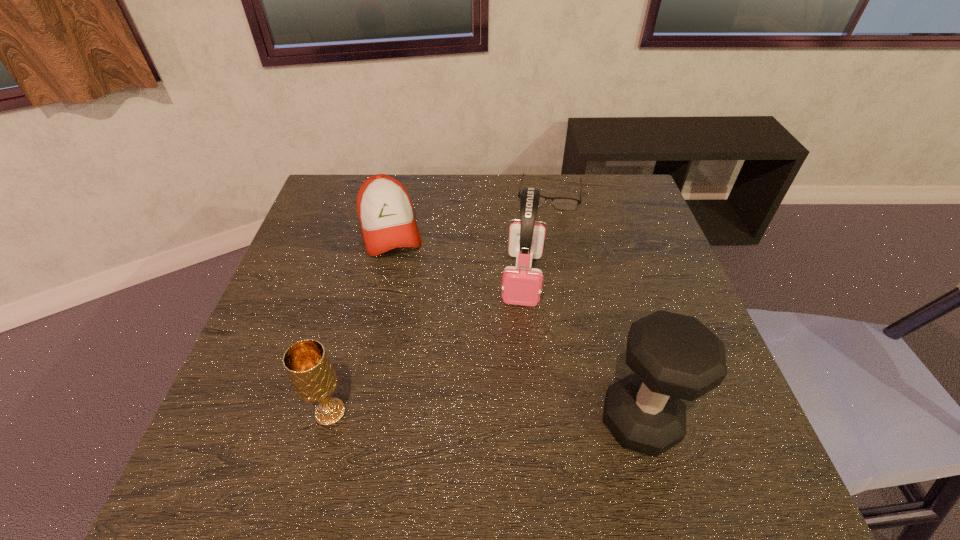
Identify the location of object at the left edge. This screenshot has width=960, height=540. (385, 212).

Locate an element on the screen. The height and width of the screenshot is (540, 960). object positioned at the right edge is located at coordinates (674, 356).

Where is `object that is at the far left corner`? object that is at the far left corner is located at coordinates (385, 212).

The height and width of the screenshot is (540, 960). I want to click on object that is positioned at the near right corner, so click(674, 356).

The height and width of the screenshot is (540, 960). What are the coordinates of `free space at the far edge` in the screenshot? It's located at (559, 213).

Locate an element on the screen. free space at the left edge of the desktop is located at coordinates (246, 378).

Where is `free space at the right edge`? Image resolution: width=960 pixels, height=540 pixels. free space at the right edge is located at coordinates (609, 243).

The width and height of the screenshot is (960, 540). In the image, there is a desktop. In order to click on vacant space at the far left corner in this screenshot , I will do `click(329, 175)`.

I want to click on free space at the far right corner of the desktop, so click(x=615, y=189).

Locate an element on the screen. free space at the near right corner of the desktop is located at coordinates (698, 399).